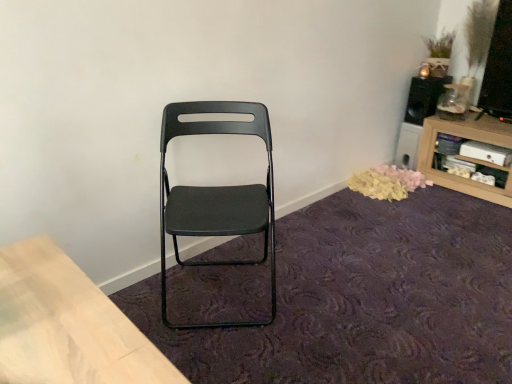
Question: Is wooden shelf at upper right touching black fabric chair at center?

Choices:
 (A) yes
 (B) no

Answer: (B)

Question: From a real-world perspective, is wooden shelf at upper right located higher than black fabric chair at center?

Choices:
 (A) no
 (B) yes

Answer: (B)

Question: Can you confirm if wooden shelf at upper right is taller than black fabric chair at center?

Choices:
 (A) yes
 (B) no

Answer: (A)

Question: From a real-world perspective, is wooden shelf at upper right beneath black fabric chair at center?

Choices:
 (A) yes
 (B) no

Answer: (B)

Question: Can you confirm if wooden shelf at upper right is smaller than black fabric chair at center?

Choices:
 (A) no
 (B) yes

Answer: (A)

Question: Is there a large distance between wooden shelf at upper right and black fabric chair at center?

Choices:
 (A) no
 (B) yes

Answer: (B)

Question: Is wooden shelf at upper right closer to camera compared to yellow fabric petals at lower right?

Choices:
 (A) yes
 (B) no

Answer: (A)

Question: Can you confirm if wooden shelf at upper right is smaller than yellow fabric petals at lower right?

Choices:
 (A) no
 (B) yes

Answer: (A)

Question: Is wooden shelf at upper right further to camera compared to yellow fabric petals at lower right?

Choices:
 (A) yes
 (B) no

Answer: (B)

Question: Is wooden shelf at upper right bigger than yellow fabric petals at lower right?

Choices:
 (A) yes
 (B) no

Answer: (A)

Question: Can you confirm if wooden shelf at upper right is shorter than yellow fabric petals at lower right?

Choices:
 (A) yes
 (B) no

Answer: (B)

Question: From the image's perspective, is wooden shelf at upper right above yellow fabric petals at lower right?

Choices:
 (A) yes
 (B) no

Answer: (A)

Question: Would you say matte black folding chair at center is a long distance from black fabric chair at center?

Choices:
 (A) yes
 (B) no

Answer: (B)